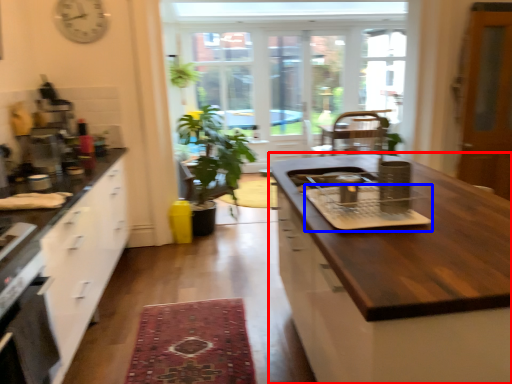
Question: Among these objects, which one is farthest to the camera, cabinetry (highlighted by a red box) or appliance (highlighted by a blue box)?

Choices:
 (A) cabinetry
 (B) appliance

Answer: (B)